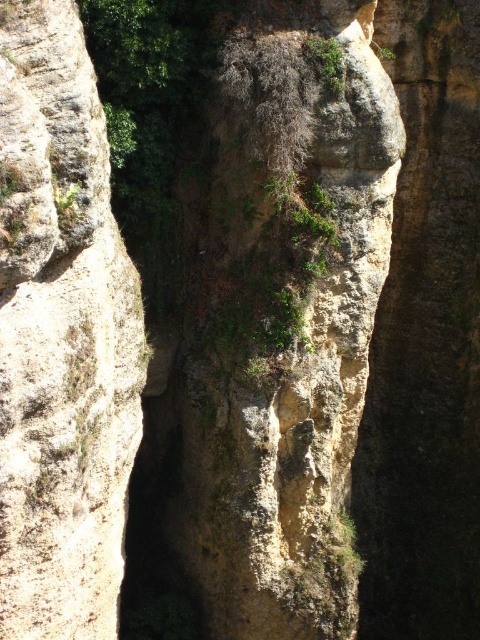
The width and height of the screenshot is (480, 640). What do you see at coordinates (60, 337) in the screenshot?
I see `rough textured rock at center` at bounding box center [60, 337].

Between rough textured rock at center and green leafy vegetation at upper center, which one appears on the right side from the viewer's perspective?

From the viewer's perspective, green leafy vegetation at upper center appears more on the right side.

Is point (78, 131) farther from viewer compared to point (325, 42)?

No, (78, 131) is in front of (325, 42).

Where is `rough textured rock at center`? The height and width of the screenshot is (640, 480). rough textured rock at center is located at coordinates (60, 337).